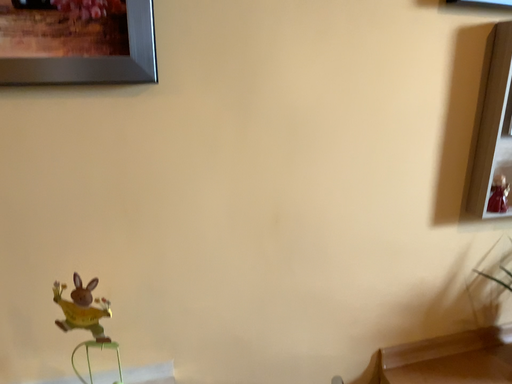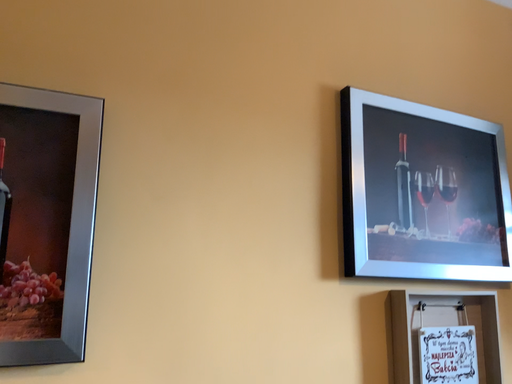
Question: How did the camera likely rotate when shooting the video?

Choices:
 (A) rotated downward
 (B) rotated upward

Answer: (B)